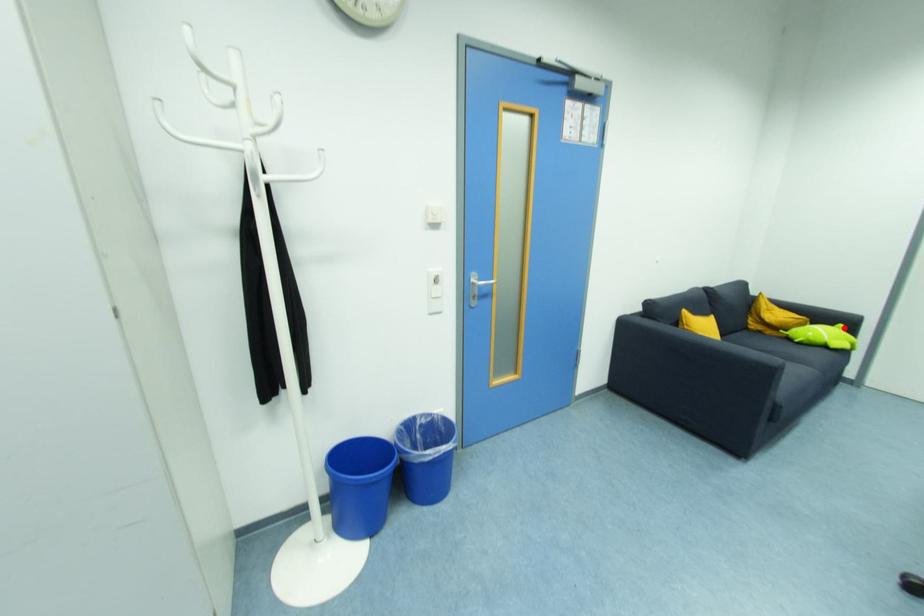
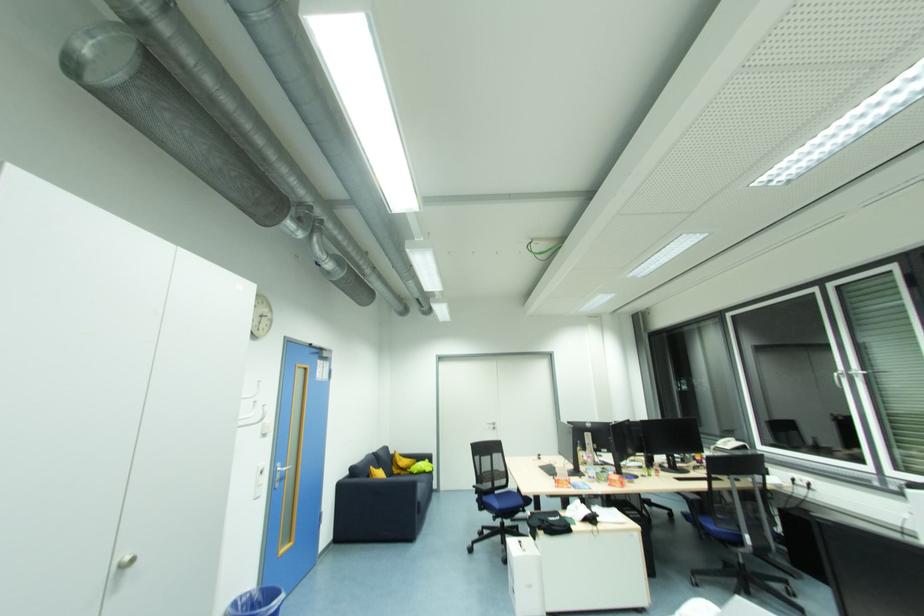
Where in the second image is the point corresponding to the highlighted location from the first image?

(430, 461)